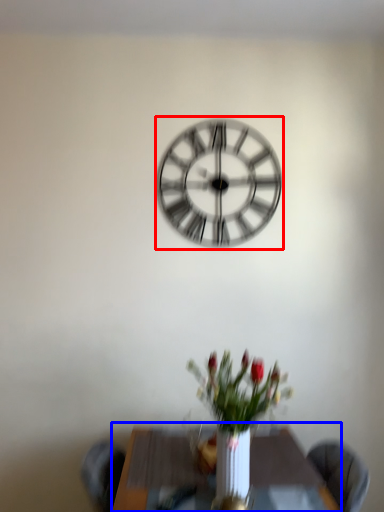
Question: Among these objects, which one is farthest to the camera, wall clock (highlighted by a red box) or table (highlighted by a blue box)?

Choices:
 (A) wall clock
 (B) table

Answer: (A)